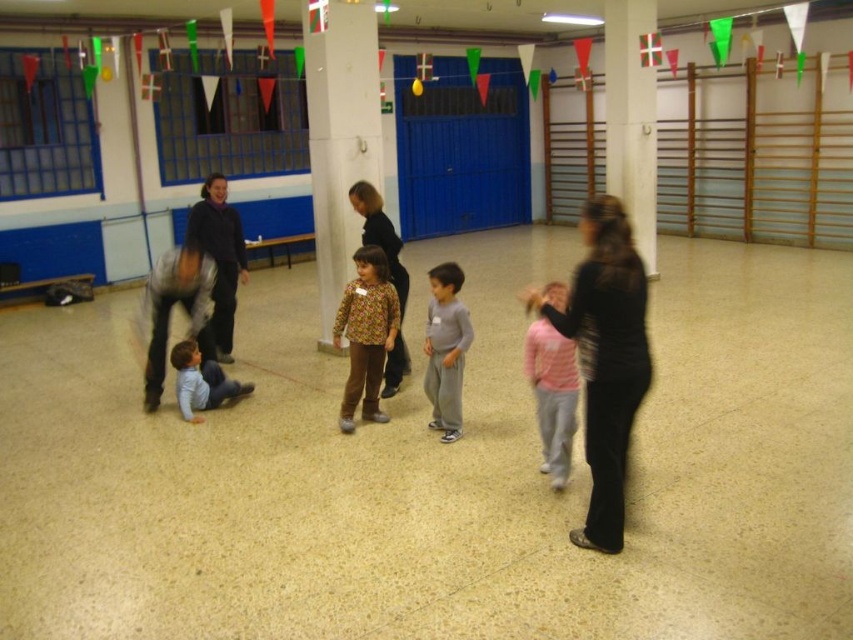
Question: Does white glossy pillar at center have a greater width compared to floral-patterned shirt at center?

Choices:
 (A) no
 (B) yes

Answer: (B)

Question: Which point is closer to the camera?

Choices:
 (A) (376, 360)
 (B) (363, 186)

Answer: (A)

Question: Is black fabric jacket at center thinner than gray matte pants at center?

Choices:
 (A) yes
 (B) no

Answer: (B)

Question: Which object is the closest to the floral fabric dress at center?

Choices:
 (A) black matte jacket at center
 (B) floral-patterned shirt at center
 (C) white glossy pillar at upper center
 (D) gray matte pants at center

Answer: (B)

Question: Which point is closer to the camera?

Choices:
 (A) (549, 296)
 (B) (393, 260)
 (C) (315, 168)

Answer: (A)

Question: Considering the relative positions of white glossy pillar at upper center and blue soft shirt at lower left in the image provided, where is white glossy pillar at upper center located with respect to blue soft shirt at lower left?

Choices:
 (A) below
 (B) above

Answer: (B)